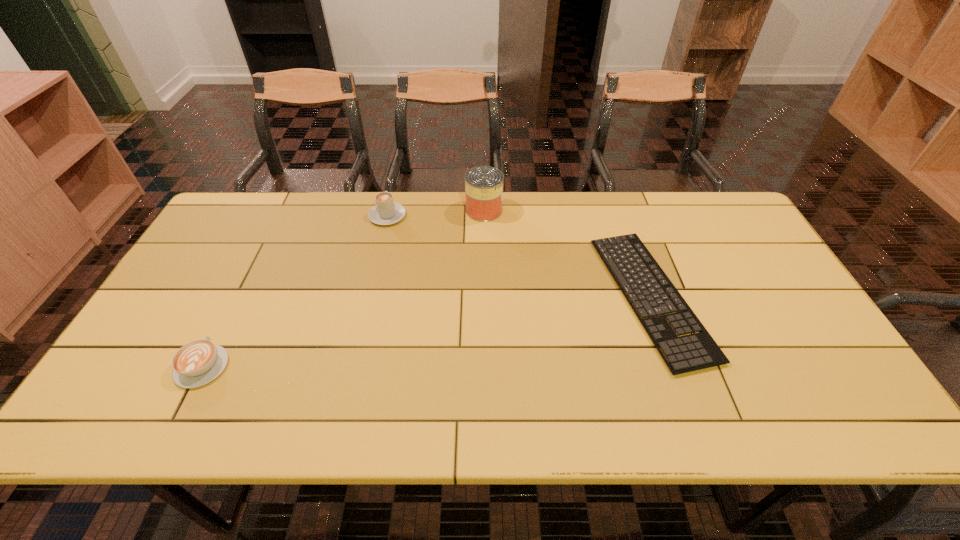
The height and width of the screenshot is (540, 960). What are the coordinates of `vacant space at the right edge` in the screenshot? It's located at tap(750, 246).

What are the coordinates of `free location at the far left corner` in the screenshot? It's located at (260, 221).

Identify the location of vacant area at the far right corner. (699, 233).

This screenshot has width=960, height=540. I want to click on vacant area between the second shortest object and the taller cappuccino, so click(x=295, y=291).

Identify the location of vacant point located between the taller cappuccino and the computer keyboard. This screenshot has height=540, width=960. (519, 256).

The image size is (960, 540). In order to click on vacant region between the taller cappuccino and the computer keyboard in this screenshot , I will do `click(519, 256)`.

Find the location of a particular element. Image resolution: width=960 pixels, height=540 pixels. free space between the third tallest object and the taller cappuccino is located at coordinates (295, 291).

Identify the location of free space between the third object from left to right and the second object from left to right. The height and width of the screenshot is (540, 960). (436, 213).

Where is `free space that is in between the farther cappuccino and the leftmost object`? Image resolution: width=960 pixels, height=540 pixels. free space that is in between the farther cappuccino and the leftmost object is located at coordinates (295, 291).

Where is `vacant area that lies between the leftmost object and the second object from right to left`? vacant area that lies between the leftmost object and the second object from right to left is located at coordinates (343, 288).